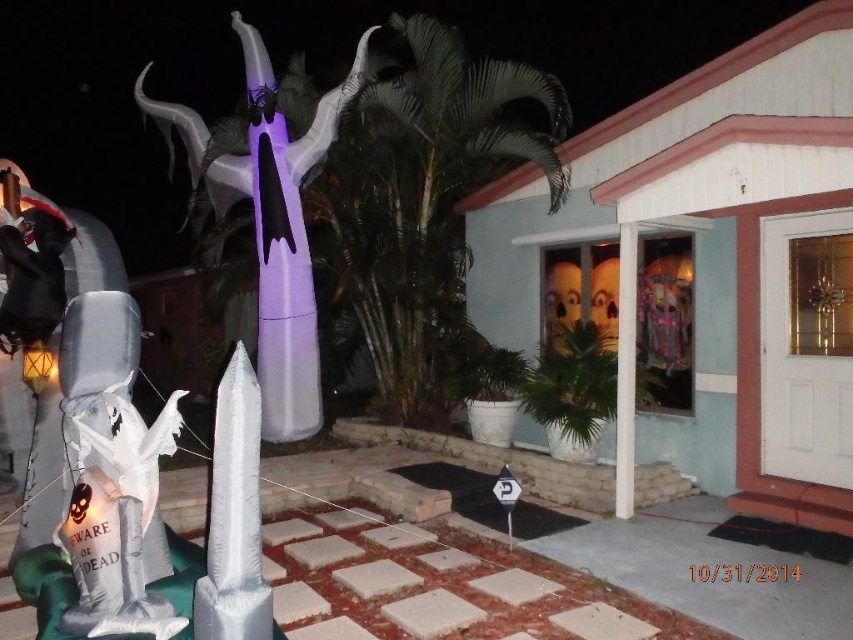
Question: Which point is farther to the camera?

Choices:
 (A) (288, 161)
 (B) (79, 483)

Answer: (A)

Question: Which object appears farthest from the camera in this image?

Choices:
 (A) white glossy ghost at lower left
 (B) purple inflatable ghost at center

Answer: (B)

Question: Is white glossy ghost at lower left further to the viewer compared to purple inflatable ghost at center?

Choices:
 (A) no
 (B) yes

Answer: (A)

Question: Does white glossy ghost at lower left have a lesser width compared to purple inflatable ghost at center?

Choices:
 (A) no
 (B) yes

Answer: (B)

Question: Among these points, which one is farthest from the camera?

Choices:
 (A) (289, 403)
 (B) (74, 310)

Answer: (A)

Question: Can you confirm if white glossy ghost at lower left is wider than purple inflatable ghost at center?

Choices:
 (A) no
 (B) yes

Answer: (A)